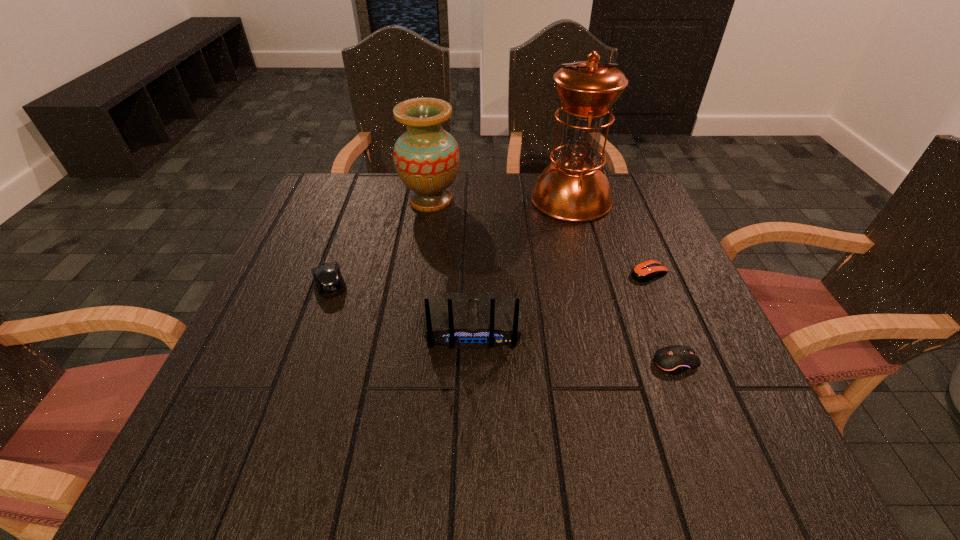
In the image, there is a desktop. Where is `free space at the near edge`? The width and height of the screenshot is (960, 540). free space at the near edge is located at coordinates (663, 463).

Where is `free spot at the left edge of the desktop`? This screenshot has width=960, height=540. free spot at the left edge of the desktop is located at coordinates pos(227,381).

The height and width of the screenshot is (540, 960). In order to click on vacant space at the right edge in this screenshot , I will do `click(684, 399)`.

The image size is (960, 540). Identify the location of vacant space at the far left corner of the desktop. (326, 179).

Identify the location of vacant region at the far right corner of the desktop. (638, 188).

Identify the location of unoccupied area between the fifth shortest object and the leftmost object. (380, 242).

You are a GUI agent. You are given a task and a screenshot of the screen. Output one action in this format:
    pyautogui.click(x=<x>, y=<y>)
    Task: Click on the empty space that is in between the router and the second tallest object
    This screenshot has width=960, height=540.
    Given the screenshot: What is the action you would take?
    pyautogui.click(x=452, y=263)

Identify the location of vacant space that's between the second tallest object and the second tallest computer mouse. The width and height of the screenshot is (960, 540). (553, 282).

You are a GUI agent. You are given a task and a screenshot of the screen. Output one action in this format:
    pyautogui.click(x=<x>, y=<y>)
    Task: Click on the empty location between the second tallest object and the fourth shortest object
    This screenshot has width=960, height=540.
    Given the screenshot: What is the action you would take?
    pyautogui.click(x=452, y=263)

At what (x,y) coordinates should I click in order to perform the action: click on free spot between the shortest computer mouse and the leftmost object. Please return your answer as a coordinate pair (x, y). Looking at the image, I should click on (490, 278).